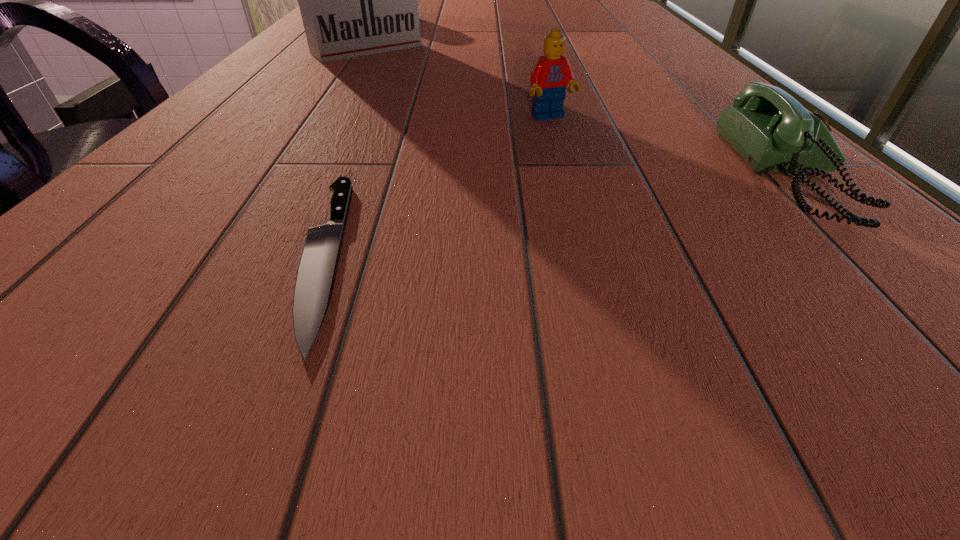
Find the location of `vacant position located 0.290m on the face of the third shortest object`. vacant position located 0.290m on the face of the third shortest object is located at coordinates (664, 227).

This screenshot has width=960, height=540. What are the coordinates of `blank space located 0.290m with the lid open on the cigarette case` in the screenshot? It's located at (460, 103).

You are a GUI agent. You are given a task and a screenshot of the screen. Output one action in this format:
    pyautogui.click(x=<x>, y=<y>)
    Task: Click on the free point located 0.070m with the lid open on the cigarette case
    The width and height of the screenshot is (960, 540).
    Given the screenshot: What is the action you would take?
    pyautogui.click(x=404, y=69)

At what (x,y) coordinates should I click in order to perform the action: click on vacant space situated 0.100m with the lid open on the cigarette case. Please return your answer as a coordinate pair (x, y). Looking at the image, I should click on (411, 73).

Where is `steak knife situated at the near edge`? This screenshot has height=540, width=960. steak knife situated at the near edge is located at coordinates (315, 272).

At what (x,y) coordinates should I click in order to perform the action: click on telephone located in the near edge section of the desktop. Please return your answer as a coordinate pair (x, y). The width and height of the screenshot is (960, 540). Looking at the image, I should click on pyautogui.click(x=767, y=127).

Where is `object located at the left edge`? The image size is (960, 540). object located at the left edge is located at coordinates (355, 0).

Locate an element on the screen. This screenshot has height=540, width=960. object located in the right edge section of the desktop is located at coordinates (767, 127).

Identify the location of object that is at the near right corner. (767, 127).

You are a GUI agent. You are given a task and a screenshot of the screen. Output one action in this format:
    pyautogui.click(x=<x>, y=<y>)
    Task: Click on the free spot at the far edge of the desktop
    Image resolution: width=960 pixels, height=540 pixels.
    Given the screenshot: What is the action you would take?
    pyautogui.click(x=444, y=2)